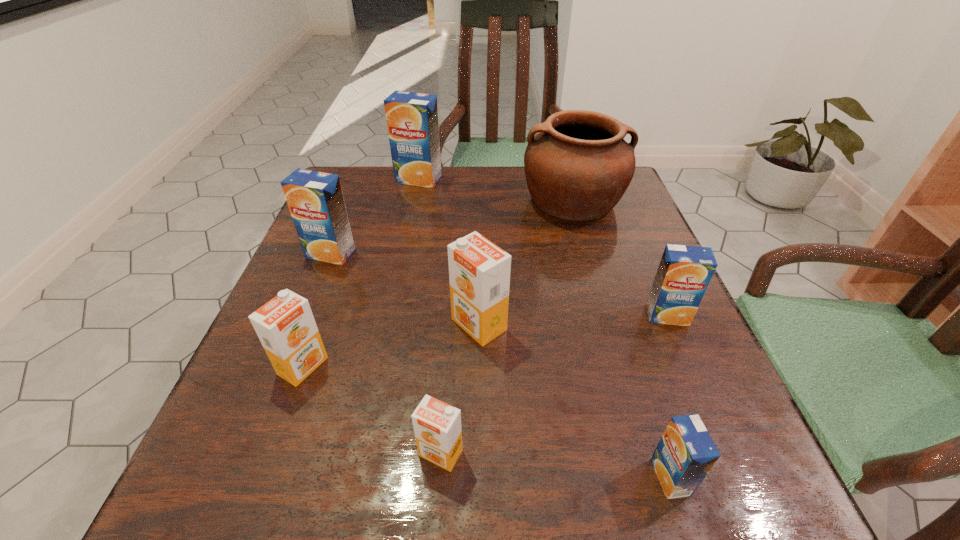
What are the coordinates of `free space at the far left corner of the desktop` in the screenshot? It's located at (370, 213).

Find the location of a particular element. The width and height of the screenshot is (960, 540). free point at the near right corner is located at coordinates (669, 525).

Image resolution: width=960 pixels, height=540 pixels. Find the location of `empty location between the leftmost blue orange_juice and the nearest orange orange juice`. empty location between the leftmost blue orange_juice and the nearest orange orange juice is located at coordinates (386, 353).

Where is `empty space between the second smallest orange orange juice and the smallest orange orange juice`? The image size is (960, 540). empty space between the second smallest orange orange juice and the smallest orange orange juice is located at coordinates (372, 409).

Locate an element on the screen. The width and height of the screenshot is (960, 540). vacant region between the biggest orange orange juice and the sixth nearest object is located at coordinates (405, 289).

Find the location of a particular element. The width and height of the screenshot is (960, 540). vacant area between the leftmost orange orange juice and the smallest orange orange juice is located at coordinates (372, 409).

The image size is (960, 540). I want to click on vacant region between the reddish pottery and the second nearest blue orange_juice, so click(620, 258).

The image size is (960, 540). Identify the location of free space between the smallest orange orange juice and the smallest blue orange_juice. (556, 465).

Find the location of a particular element. This screenshot has height=540, width=960. empty location between the second orange juice from right to left and the third orange juice from left to right is located at coordinates (544, 328).

Image resolution: width=960 pixels, height=540 pixels. Identify the location of free spot between the farthest orange juice and the second orange juice from right to left. (544, 328).